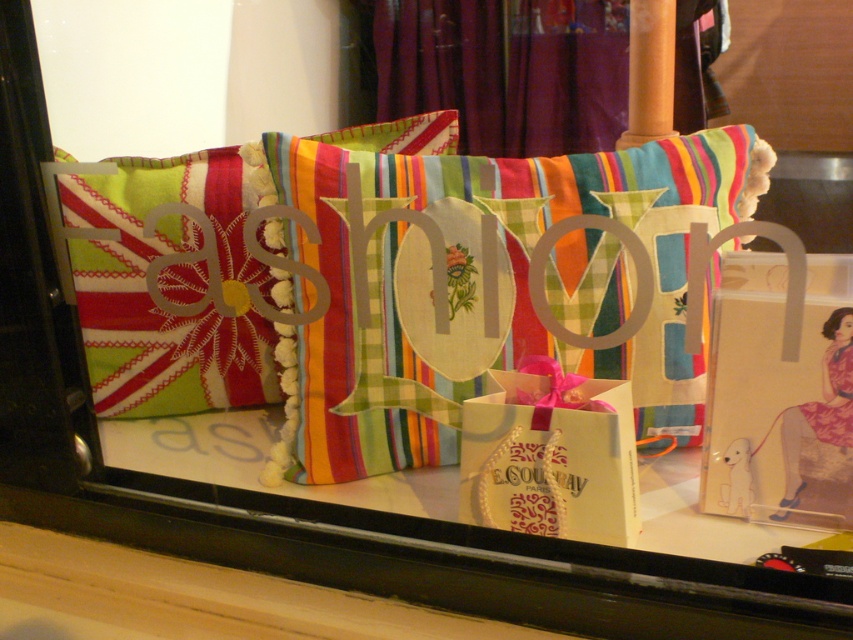
You are a store employee arranging items in the display window. You need to place a new item that requires a space taller than the white paper gift bag at center. Can the textured fabric pillow at center provide enough height for this new item?

The textured fabric pillow at center is taller than the white paper gift bag at center, so yes, it can provide enough height for the new item.

You are a store employee who needs to pack a customer order. The order requires placing the white paper gift bag at center inside the striped fabric pillow at center. Is this possible based on the items shown in the scene?

The striped fabric pillow at center has a larger size compared to the white paper gift bag at center, so yes, it is possible to place the white paper gift bag at center inside the striped fabric pillow at center since the pillow is bigger in size.

You are arranging a display in a store and need to place the striped fabric pillow at center and the textured fabric pillow at center in a specific order. According to the scene, which pillow should be placed on the left side?

The textured fabric pillow at center should be placed on the left side because the striped fabric pillow at center is to the right of it in the scene.